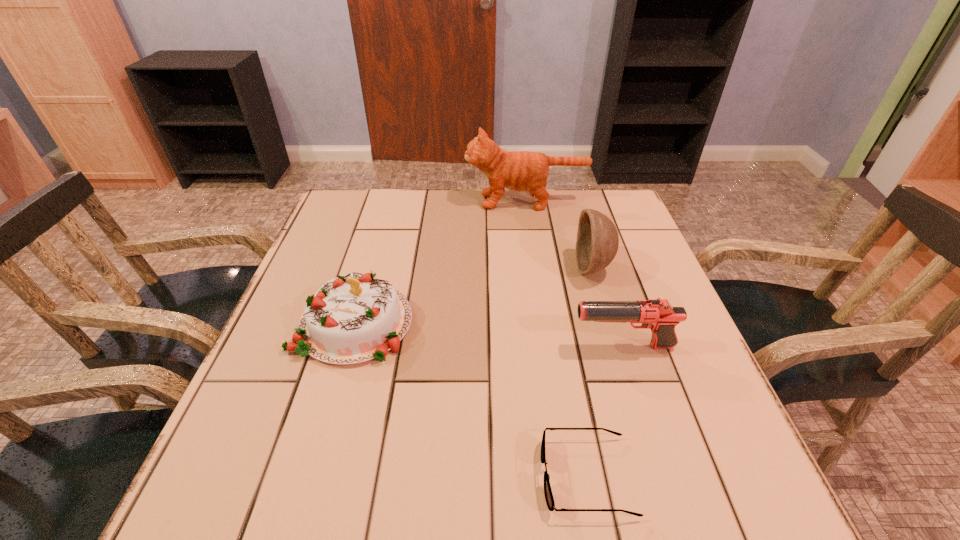
At what (x,y) coordinates should I click in order to perform the action: click on the closest object relative to the farthest object. Please return your answer as a coordinate pair (x, y). Image resolution: width=960 pixels, height=540 pixels. Looking at the image, I should click on (597, 242).

Locate an element on the screen. object that stands as the third closest to the second tallest object is located at coordinates (549, 498).

The width and height of the screenshot is (960, 540). I want to click on free location that satisfies the following two spatial constraints: 1. on the front side of the bowl; 2. on the front-facing side of the spectacles, so click(x=656, y=476).

The width and height of the screenshot is (960, 540). I want to click on free location that satisfies the following two spatial constraints: 1. on the face of the farthest object; 2. on the front side of the leftmost object, so click(543, 323).